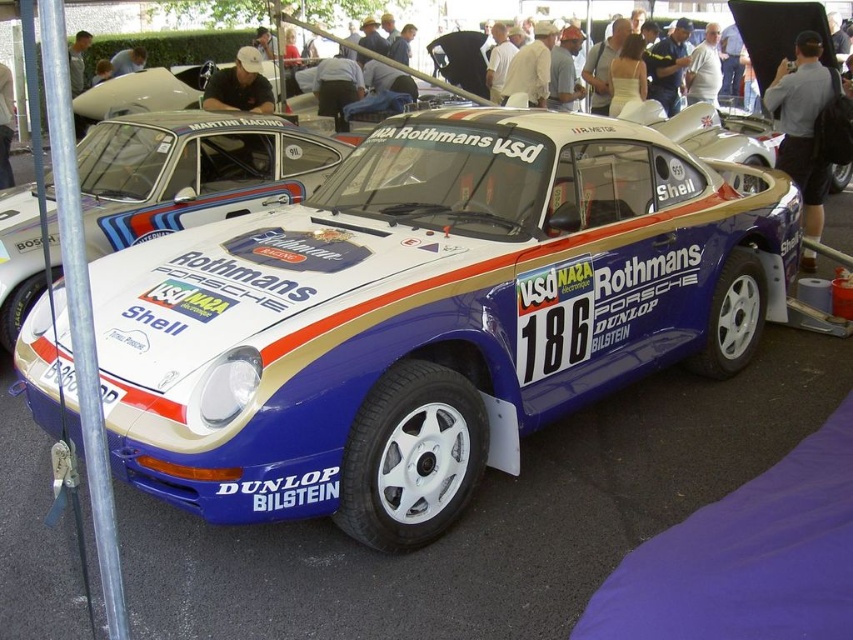
Is point (163, 92) positioned before point (138, 60)?

Yes, point (163, 92) is in front of point (138, 60).

Measure the distance between white matte porsche at center and camera.

9.01 meters

The height and width of the screenshot is (640, 853). I want to click on white matte porsche at center, so tap(143, 92).

Between matte white porsche at center and white matte porsche at center, which one has more height?

matte white porsche at center is taller.

Who is positioned more to the right, matte white porsche at center or white matte porsche at center?

Positioned to the right is matte white porsche at center.

Is point (169, 136) more distant than point (180, 77)?

No, it is in front of (180, 77).

The width and height of the screenshot is (853, 640). I want to click on matte white porsche at center, so click(192, 172).

Between matte white porsche at center and light brown leather jacket at upper center, which one has less height?

light brown leather jacket at upper center is shorter.

Locate an element on the screen. The height and width of the screenshot is (640, 853). matte white porsche at center is located at coordinates (192, 172).

This screenshot has width=853, height=640. In order to click on matte white porsche at center in this screenshot , I will do `click(192, 172)`.